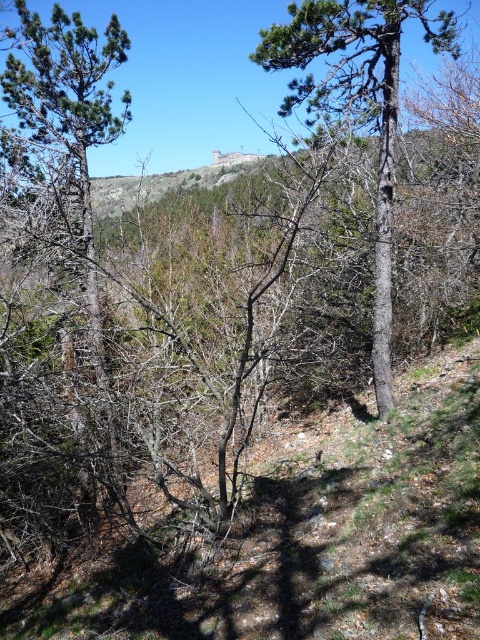
Is point (283, 115) closer to camera compared to point (120, 488)?

No, (283, 115) is further to viewer.

Does smooth bark tree at center lie in front of green pine tree at left?

Yes, smooth bark tree at center is in front of green pine tree at left.

Who is more distant from viewer, [362,22] or [91,252]?

The point [91,252] is behind.

You are a GUI agent. You are given a task and a screenshot of the screen. Output one action in this format:
    pyautogui.click(x=<x>, y=<y>)
    Task: Click on the smooth bark tree at center
    This screenshot has height=640, width=480.
    Given the screenshot: What is the action you would take?
    pyautogui.click(x=358, y=106)